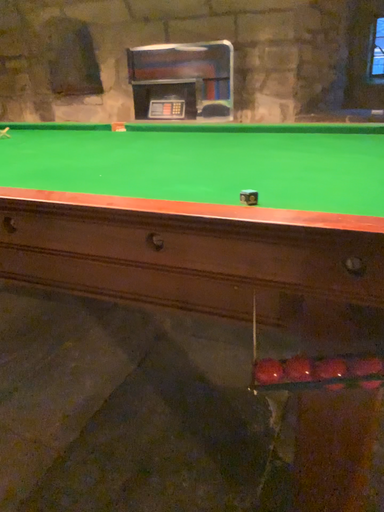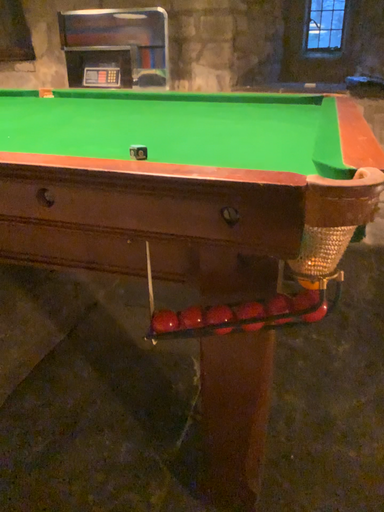
Question: How did the camera likely rotate when shooting the video?

Choices:
 (A) rotated left
 (B) rotated right

Answer: (B)